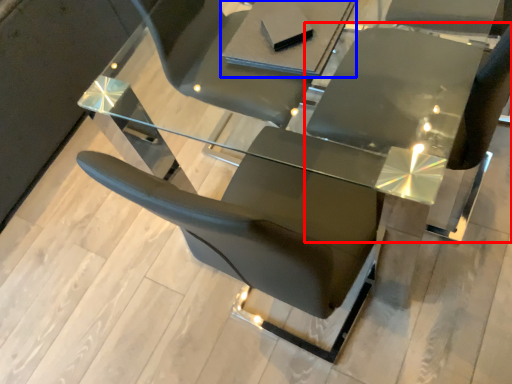
Question: Which of the following is the farthest to the observer, chair (highlighted by a red box) or table (highlighted by a blue box)?

Choices:
 (A) chair
 (B) table

Answer: (B)